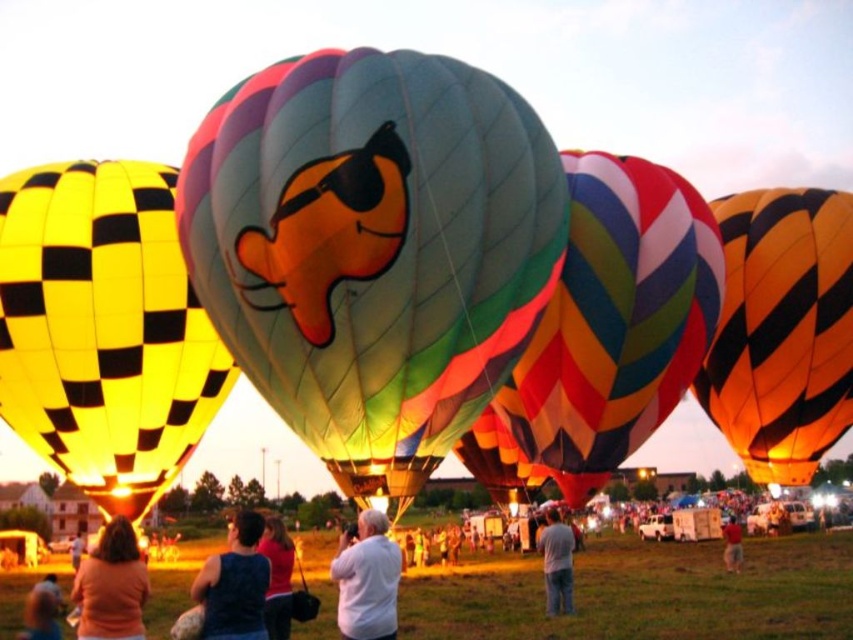
Question: Considering the relative positions of multicolored striped fabric hot air balloon at center and white matte shirt at center in the image provided, where is multicolored striped fabric hot air balloon at center located with respect to white matte shirt at center?

Choices:
 (A) left
 (B) right

Answer: (B)

Question: Does orange striped balloon at right appear on the left side of matte pink shirt at center?

Choices:
 (A) no
 (B) yes

Answer: (A)

Question: Among these points, which one is nearest to the camera?

Choices:
 (A) (264, 541)
 (B) (546, 602)
 (C) (90, 636)
 (D) (457, 240)

Answer: (D)

Question: Which of the following is the farthest from the observer?

Choices:
 (A) (428, 390)
 (B) (548, 556)
 (C) (277, 612)

Answer: (B)

Question: Can you confirm if yellow checkered fabric hot air balloon at left is positioned to the left of red shirt at center?

Choices:
 (A) no
 (B) yes

Answer: (B)

Question: Among these objects, which one is nearest to the camera?

Choices:
 (A) blue sleeveless shirt at lower left
 (B) orange cotton shirt at lower left
 (C) red shirt at center
 (D) matte pink shirt at center

Answer: (A)